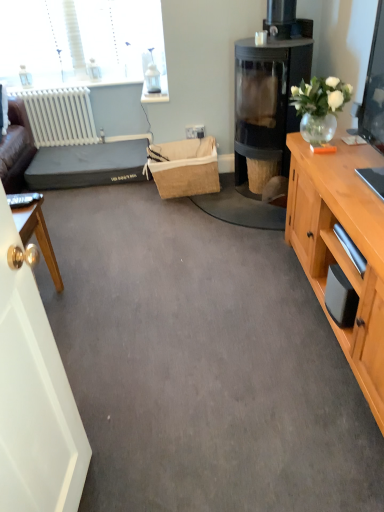
At what (x,y) coordinates should I click in order to perform the action: click on dark gray fabric dog bed at left. Please return your answer as a coordinate pair (x, y). This screenshot has height=512, width=384. Looking at the image, I should click on (87, 165).

Image resolution: width=384 pixels, height=512 pixels. Describe the element at coordinates (269, 92) in the screenshot. I see `transparent glass fireplace at upper right` at that location.

Where is `wooden drawer at right`? This screenshot has width=384, height=512. wooden drawer at right is located at coordinates (333, 252).

The height and width of the screenshot is (512, 384). I want to click on white matte radiator at left, so click(60, 116).

Consider the image. Measure the distance between clear glass vase at upper right and camera.

clear glass vase at upper right and camera are 6.60 feet apart from each other.

This screenshot has height=512, width=384. Find the location of `dark gray fabric dog bed at left`. dark gray fabric dog bed at left is located at coordinates [x=87, y=165].

From a real-world perspective, is wooden drawer at right physically below polished wood desk at left?

Incorrect, from a real-world perspective, wooden drawer at right is higher than polished wood desk at left.

From the image's perspective, is wooden drawer at right located above or below polished wood desk at left?

wooden drawer at right is above polished wood desk at left.

In terms of width, does wooden drawer at right look wider or thinner when compared to polished wood desk at left?

In the image, wooden drawer at right appears to be wider than polished wood desk at left.

Is wooden drawer at right positioned in front of polished wood desk at left?

Yes.

Measure the distance between wooden drawer at right and transparent glass fireplace at upper right.

wooden drawer at right and transparent glass fireplace at upper right are 3.84 feet apart from each other.

Considering the relative sizes of wooden drawer at right and transparent glass fireplace at upper right in the image provided, is wooden drawer at right wider than transparent glass fireplace at upper right?

No.

Considering the positions of objects wooden drawer at right and transparent glass fireplace at upper right in the image provided, who is in front, wooden drawer at right or transparent glass fireplace at upper right?

wooden drawer at right is in front.

Looking at their sizes, would you say white glossy door at left is wider or thinner than dark gray fabric dog bed at left?

Clearly, white glossy door at left has less width compared to dark gray fabric dog bed at left.

In terms of size, does white glossy door at left appear bigger or smaller than dark gray fabric dog bed at left?

Clearly, white glossy door at left is smaller in size than dark gray fabric dog bed at left.

Considering the positions of objects white glossy door at left and dark gray fabric dog bed at left in the image provided, who is more to the right, white glossy door at left or dark gray fabric dog bed at left?

white glossy door at left.

From a real-world perspective, is white glossy door at left physically located above or below dark gray fabric dog bed at left?

white glossy door at left is above dark gray fabric dog bed at left.

Which of these two, transparent glass fireplace at upper right or wooden drawer at right, is thinner?

wooden drawer at right.

Does transparent glass fireplace at upper right have a greater height compared to wooden drawer at right?

Correct, transparent glass fireplace at upper right is much taller as wooden drawer at right.

Is transparent glass fireplace at upper right aimed at wooden drawer at right?

No, transparent glass fireplace at upper right does not turn towards wooden drawer at right.

Looking at this image, is transparent glass fireplace at upper right at the left side of wooden drawer at right?

Yes.

Looking at the image, does white matte radiator at left seem bigger or smaller compared to clear glass vase at upper right?

white matte radiator at left is bigger than clear glass vase at upper right.

Which object is positioned more to the left, white matte radiator at left or clear glass vase at upper right?

white matte radiator at left.

Is white matte radiator at left beside clear glass vase at upper right?

No, white matte radiator at left is not beside clear glass vase at upper right.

From the image's perspective, which one is positioned higher, white matte radiator at left or polished wood desk at left?

white matte radiator at left is shown above in the image.

Considering the points (89, 127) and (22, 234), which point is in front, point (89, 127) or point (22, 234)?

Positioned in front is point (22, 234).

From a real-world perspective, is white matte radiator at left positioned above or below polished wood desk at left?

Clearly, from a real-world perspective, white matte radiator at left is above polished wood desk at left.

Is transparent glass fireplace at upper right a part of polished wood desk at left?

No, transparent glass fireplace at upper right is not surrounded by polished wood desk at left.

How many degrees apart are the facing directions of polished wood desk at left and transparent glass fireplace at upper right?

The angular difference between polished wood desk at left and transparent glass fireplace at upper right is 177 degrees.

From a real-world perspective, who is located higher, polished wood desk at left or transparent glass fireplace at upper right?

In real-world perspective, transparent glass fireplace at upper right is above.

Considering the positions of points (12, 212) and (284, 23), is point (12, 212) farther from camera compared to point (284, 23)?

That is False.

You are a GUI agent. You are given a task and a screenshot of the screen. Output one action in this format:
    pyautogui.click(x=<x>, y=<y>)
    Task: Click on the drawer positioned vertically above the polished wood desk at left (from a real-world perspective)
    This screenshot has width=384, height=512.
    Given the screenshot: What is the action you would take?
    pyautogui.click(x=333, y=252)

This screenshot has height=512, width=384. Identify the location of drawer below the transparent glass fireplace at upper right (from the image's perspective). (333, 252).

Estimate the real-world distances between objects in this image. Which object is closer to white matte radiator at left, white glossy door at left or polished wood desk at left?

polished wood desk at left is positioned closer to the anchor white matte radiator at left.

Looking at the image, which one is located closer to dark gray fabric dog bed at left, white matte radiator at left or polished wood desk at left?

Based on the image, white matte radiator at left appears to be nearer to dark gray fabric dog bed at left.

Based on their spatial positions, is white glossy door at left or dark gray fabric dog bed at left closer to transparent glass fireplace at upper right?

Based on the image, dark gray fabric dog bed at left appears to be nearer to transparent glass fireplace at upper right.

Based on their spatial positions, is white glossy door at left or clear glass vase at upper right closer to polished wood desk at left?

white glossy door at left.

Based on their spatial positions, is white matte radiator at left or polished wood desk at left further from white glossy door at left?

Among the two, white matte radiator at left is located further to white glossy door at left.

Looking at the image, which one is located closer to clear glass vase at upper right, polished wood desk at left or white matte radiator at left?

Among the two, polished wood desk at left is located nearer to clear glass vase at upper right.

Looking at the image, which one is located further to white matte radiator at left, wooden drawer at right or polished wood desk at left?

Among the two, wooden drawer at right is located further to white matte radiator at left.

From the image, which object appears to be nearer to white matte radiator at left, dark gray fabric dog bed at left or polished wood desk at left?

dark gray fabric dog bed at left is positioned closer to the anchor white matte radiator at left.

Locate an element on the screen. drawer located between white glossy door at left and clear glass vase at upper right in the depth direction is located at coordinates 333,252.

Identify the location of drawer between white glossy door at left and transparent glass fireplace at upper right in the front-back direction. (333, 252).

The width and height of the screenshot is (384, 512). I want to click on glass door between polished wood desk at left and clear glass vase at upper right, so click(x=34, y=397).

The width and height of the screenshot is (384, 512). I want to click on houseplant located between polished wood desk at left and dark gray fabric dog bed at left in the depth direction, so click(x=319, y=106).